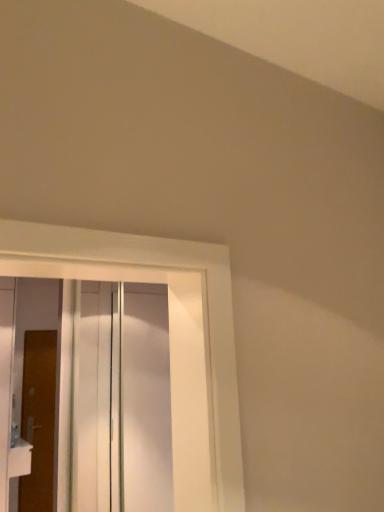
The image size is (384, 512). Find the location of `brown wooden door at left, which appears as the first door when viewed from the back`. brown wooden door at left, which appears as the first door when viewed from the back is located at coordinates (39, 419).

At what (x,y) coordinates should I click in order to perform the action: click on transparent glass door at center. Please return your answer as a coordinate pair (x, y). The width and height of the screenshot is (384, 512). Looking at the image, I should click on (170, 339).

What do you see at coordinates (19, 459) in the screenshot? This screenshot has height=512, width=384. I see `white plastic sink at lower left` at bounding box center [19, 459].

I want to click on brown wooden door at left, which appears as the first door when viewed from the back, so click(x=39, y=419).

Looking at this image, can white glossy door at left, placed as the second door when sorted from back to front, be found inside white plastic sink at lower left?

Definitely not — white glossy door at left, placed as the second door when sorted from back to front, is not inside white plastic sink at lower left.

Is white plastic sink at lower left positioned behind white glossy door at left, the 1th door when ordered from front to back?

Yes, it is behind white glossy door at left, the 1th door when ordered from front to back.

Which is behind, point (17, 451) or point (11, 397)?

Positioned behind is point (11, 397).

From a real-world perspective, is white plastic sink at lower left located higher than white glossy door at left, the 1th door when ordered from front to back?

Incorrect, from a real-world perspective, white plastic sink at lower left is lower than white glossy door at left, the 1th door when ordered from front to back.

From their relative heights in the image, would you say white plastic sink at lower left is taller or shorter than brown wooden door at left, which appears as the first door when viewed from the back?

white plastic sink at lower left is shorter than brown wooden door at left, which appears as the first door when viewed from the back.

What's the angular difference between white plastic sink at lower left and brown wooden door at left, arranged as the second door when viewed from the front,'s facing directions?

90 degrees.

Is white plastic sink at lower left directly adjacent to brown wooden door at left, arranged as the second door when viewed from the front?

No, white plastic sink at lower left is not touching brown wooden door at left, arranged as the second door when viewed from the front.

Is white plastic sink at lower left oriented towards brown wooden door at left, arranged as the second door when viewed from the front?

No.

From the image's perspective, which one is positioned higher, white glossy door at left, placed as the second door when sorted from back to front, or white plastic sink at lower left?

From the image's view, white glossy door at left, placed as the second door when sorted from back to front, is above.

Between white glossy door at left, placed as the second door when sorted from back to front, and white plastic sink at lower left, which one appears on the left side from the viewer's perspective?

Positioned to the left is white glossy door at left, placed as the second door when sorted from back to front.

In the scene shown: From a real-world perspective, does white glossy door at left, the 1th door when ordered from front to back, stand above white plastic sink at lower left?

Indeed, from a real-world perspective, white glossy door at left, the 1th door when ordered from front to back, stands above white plastic sink at lower left.

Is brown wooden door at left, arranged as the second door when viewed from the front, taller than white glossy door at left, placed as the second door when sorted from back to front?

In fact, brown wooden door at left, arranged as the second door when viewed from the front, may be shorter than white glossy door at left, placed as the second door when sorted from back to front.

Does brown wooden door at left, which appears as the first door when viewed from the back, touch white glossy door at left, placed as the second door when sorted from back to front?

brown wooden door at left, which appears as the first door when viewed from the back, and white glossy door at left, placed as the second door when sorted from back to front, are clearly separated.

Could you tell me if brown wooden door at left, which appears as the first door when viewed from the back, is facing white glossy door at left, the 1th door when ordered from front to back?

No, brown wooden door at left, which appears as the first door when viewed from the back, does not turn towards white glossy door at left, the 1th door when ordered from front to back.

Looking at their sizes, would you say brown wooden door at left, arranged as the second door when viewed from the front, is wider or thinner than white glossy door at left, placed as the second door when sorted from back to front?

brown wooden door at left, arranged as the second door when viewed from the front, is wider than white glossy door at left, placed as the second door when sorted from back to front.

In the scene shown: Does transparent glass door at center turn towards white glossy door at left, the 1th door when ordered from front to back?

No, transparent glass door at center is not turned towards white glossy door at left, the 1th door when ordered from front to back.

Which is in front, transparent glass door at center or white glossy door at left, placed as the second door when sorted from back to front?

transparent glass door at center is more forward.

Considering the relative sizes of transparent glass door at center and white glossy door at left, the 1th door when ordered from front to back, in the image provided, is transparent glass door at center shorter than white glossy door at left, the 1th door when ordered from front to back,?

Yes, transparent glass door at center is shorter than white glossy door at left, the 1th door when ordered from front to back.

From the image's perspective, count 1st doors downward from the transparent glass door at center and point to it. Please provide its 2D coordinates.

[(6, 380)]

Which door is the 1st one when counting from the left side of the transparent glass door at center? Please provide its 2D coordinates.

[(39, 419)]

Which object is wider, brown wooden door at left, arranged as the second door when viewed from the front, or transparent glass door at center?

With larger width is transparent glass door at center.

From a real-world perspective, is white plastic sink at lower left positioned over transparent glass door at center based on gravity?

A: Incorrect, from a real-world perspective, white plastic sink at lower left is lower than transparent glass door at center.

Which is more to the left, white plastic sink at lower left or transparent glass door at center?

Positioned to the left is white plastic sink at lower left.

Is white plastic sink at lower left spatially inside transparent glass door at center, or outside of it?

white plastic sink at lower left is not enclosed by transparent glass door at center.

Where is `sink on the right of white glossy door at left, placed as the second door when sorted from back to front`? This screenshot has width=384, height=512. sink on the right of white glossy door at left, placed as the second door when sorted from back to front is located at coordinates (19, 459).

Where is `the 1st door above when counting from the white plastic sink at lower left (from the image's perspective)`? The width and height of the screenshot is (384, 512). the 1st door above when counting from the white plastic sink at lower left (from the image's perspective) is located at coordinates (39, 419).

Based on their spatial positions, is white plastic sink at lower left or transparent glass door at center further from brown wooden door at left, which appears as the first door when viewed from the back?

transparent glass door at center is further to brown wooden door at left, which appears as the first door when viewed from the back.

When comparing their distances from white plastic sink at lower left, does white glossy door at left, the 1th door when ordered from front to back, or transparent glass door at center seem further?

The object further to white plastic sink at lower left is transparent glass door at center.

Based on their spatial positions, is brown wooden door at left, arranged as the second door when viewed from the front, or transparent glass door at center closer to white glossy door at left, the 1th door when ordered from front to back?

Based on the image, brown wooden door at left, arranged as the second door when viewed from the front, appears to be nearer to white glossy door at left, the 1th door when ordered from front to back.

Looking at the image, which one is located closer to white plastic sink at lower left, white glossy door at left, the 1th door when ordered from front to back, or brown wooden door at left, which appears as the first door when viewed from the back?

white glossy door at left, the 1th door when ordered from front to back, lies closer to white plastic sink at lower left than the other object.

Looking at the image, which one is located closer to brown wooden door at left, which appears as the first door when viewed from the back, transparent glass door at center or white plastic sink at lower left?

white plastic sink at lower left lies closer to brown wooden door at left, which appears as the first door when viewed from the back, than the other object.

From the image, which object appears to be nearer to brown wooden door at left, which appears as the first door when viewed from the back, white glossy door at left, placed as the second door when sorted from back to front, or transparent glass door at center?

white glossy door at left, placed as the second door when sorted from back to front, is closer to brown wooden door at left, which appears as the first door when viewed from the back.

Looking at the image, which one is located further to white glossy door at left, the 1th door when ordered from front to back, white plastic sink at lower left or brown wooden door at left, which appears as the first door when viewed from the back?

Based on the image, brown wooden door at left, which appears as the first door when viewed from the back, appears to be further to white glossy door at left, the 1th door when ordered from front to back.

Looking at the image, which one is located further to brown wooden door at left, arranged as the second door when viewed from the front, transparent glass door at center or white glossy door at left, placed as the second door when sorted from back to front?

The object further to brown wooden door at left, arranged as the second door when viewed from the front, is transparent glass door at center.

Where is `door positioned between transparent glass door at center and white plastic sink at lower left from near to far`? door positioned between transparent glass door at center and white plastic sink at lower left from near to far is located at coordinates (6, 380).

The image size is (384, 512). Identify the location of sink located between transparent glass door at center and brown wooden door at left, which appears as the first door when viewed from the back, in the depth direction. (19, 459).

Find the location of `door between transparent glass door at center and brown wooden door at left, which appears as the first door when viewed from the back, in the front-back direction`. door between transparent glass door at center and brown wooden door at left, which appears as the first door when viewed from the back, in the front-back direction is located at coordinates (6, 380).

Where is `sink between white glossy door at left, placed as the second door when sorted from back to front, and brown wooden door at left, arranged as the second door when viewed from the front, from front to back`? sink between white glossy door at left, placed as the second door when sorted from back to front, and brown wooden door at left, arranged as the second door when viewed from the front, from front to back is located at coordinates [19, 459].